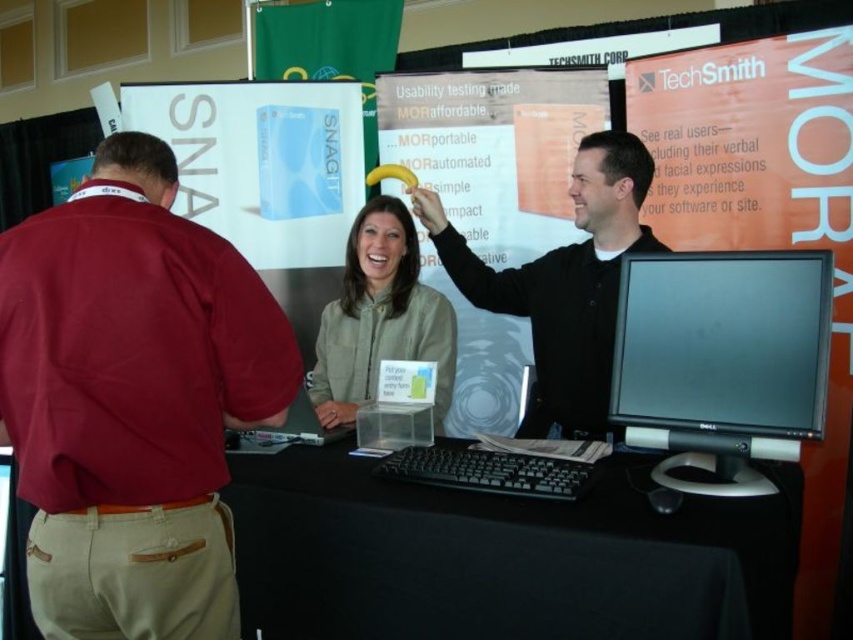
Does point (265, 348) come closer to viewer compared to point (611, 198)?

Yes, point (265, 348) is in front of point (611, 198).

Which is in front, point (102, 470) or point (607, 211)?

Point (102, 470) is more forward.

This screenshot has height=640, width=853. Describe the element at coordinates (132, 401) in the screenshot. I see `maroon cotton shirt at left` at that location.

Identify the location of maroon cotton shirt at left. This screenshot has height=640, width=853. (132, 401).

Which is in front, point (202, 435) or point (345, 253)?

Point (202, 435)

Image resolution: width=853 pixels, height=640 pixels. Find the location of `maroon cotton shirt at left`. maroon cotton shirt at left is located at coordinates (132, 401).

Identify the location of maroon cotton shirt at left. (132, 401).

Is point (733, 426) farther from viewer compared to point (363, 211)?

No, it is in front of (363, 211).

You are a GUI agent. You are given a task and a screenshot of the screen. Output one action in this format:
    pyautogui.click(x=<x>, y=<y>)
    Task: Click on the black glossy monitor at center
    
    Given the screenshot: What is the action you would take?
    pyautogui.click(x=722, y=362)